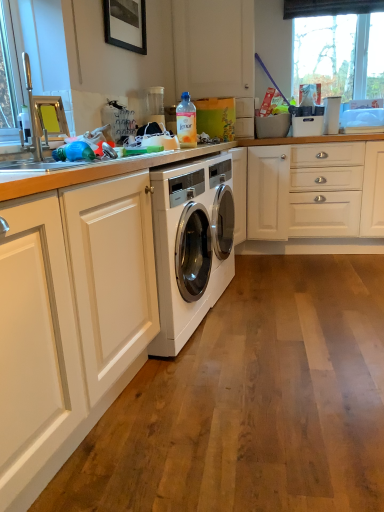
Measure the distance between transparent glass window at upper right and camera.

transparent glass window at upper right is 3.44 meters away from camera.

This screenshot has width=384, height=512. Identify the location of brushed metal sink at left. (40, 132).

The width and height of the screenshot is (384, 512). I want to click on black matte picture frame at upper center, so click(x=126, y=24).

From the image's perspective, is white glossy washing machine at center located beneath black matte picture frame at upper center?

Correct, white glossy washing machine at center appears lower than black matte picture frame at upper center in the image.

Which of these two, white glossy washing machine at center or black matte picture frame at upper center, is thinner?

With smaller width is black matte picture frame at upper center.

Does point (182, 227) come in front of point (128, 41)?

Yes, point (182, 227) is in front of point (128, 41).

Is white glossy washing machine at center oriented away from black matte picture frame at upper center?

No, black matte picture frame at upper center is not at the back of white glossy washing machine at center.

Considering the positions of points (326, 45) and (135, 49), is point (326, 45) closer to camera compared to point (135, 49)?

No.

Does transparent glass window at upper right turn towards black matte picture frame at upper center?

No, transparent glass window at upper right does not turn towards black matte picture frame at upper center.

Considering their positions, is transparent glass window at upper right located in front of or behind black matte picture frame at upper center?

Visually, transparent glass window at upper right is located behind black matte picture frame at upper center.

Considering the relative sizes of transparent glass window at upper right and black matte picture frame at upper center in the image provided, is transparent glass window at upper right bigger than black matte picture frame at upper center?

Yes.

Is brushed metal sink at left facing away from translucent plastic bottle at upper center?

No.

Is there a large distance between brushed metal sink at left and translucent plastic bottle at upper center?

brushed metal sink at left is actually quite close to translucent plastic bottle at upper center.

From the image's perspective, which is below, brushed metal sink at left or translucent plastic bottle at upper center?

brushed metal sink at left appears lower in the image.

Which object is thinner, white glossy washing machine at center or transparent glass window at upper right?

transparent glass window at upper right.

Looking at the image, does white glossy washing machine at center seem bigger or smaller compared to transparent glass window at upper right?

white glossy washing machine at center is bigger than transparent glass window at upper right.

How different are the orientations of white glossy washing machine at center and transparent glass window at upper right in degrees?

The angle between the facing direction of white glossy washing machine at center and the facing direction of transparent glass window at upper right is 80.7 degrees.

Looking at this image, is white glossy washing machine at center situated inside transparent glass window at upper right or outside?

white glossy washing machine at center is not inside transparent glass window at upper right, it's outside.

From the image's perspective, which is above, brushed metal sink at left or transparent glass window at upper right?

transparent glass window at upper right is shown above in the image.

Is brushed metal sink at left aimed at transparent glass window at upper right?

No, brushed metal sink at left does not turn towards transparent glass window at upper right.

In terms of width, does brushed metal sink at left look wider or thinner when compared to transparent glass window at upper right?

brushed metal sink at left is wider than transparent glass window at upper right.

Which is farther from the camera, (32, 106) or (376, 95)?

Point (376, 95)

Is brushed metal sink at left beside white glossy washing machine at center?

No, brushed metal sink at left is not with white glossy washing machine at center.

Who is taller, brushed metal sink at left or white glossy washing machine at center?

Standing taller between the two is white glossy washing machine at center.

Visually, is brushed metal sink at left positioned to the left or to the right of white glossy washing machine at center?

Based on their positions, brushed metal sink at left is located to the left of white glossy washing machine at center.

From the image's perspective, does brushed metal sink at left appear lower than white glossy washing machine at center?

Actually, brushed metal sink at left appears above white glossy washing machine at center in the image.

Is translucent plastic bottle at upper center not near black matte picture frame at upper center?

They are positioned close to each other.

Looking at this image, is translucent plastic bottle at upper center bigger or smaller than black matte picture frame at upper center?

Considering their sizes, translucent plastic bottle at upper center takes up less space than black matte picture frame at upper center.

From the image's perspective, which one is positioned lower, translucent plastic bottle at upper center or black matte picture frame at upper center?

translucent plastic bottle at upper center appears lower in the image.

This screenshot has height=512, width=384. Find the location of `picture frame on the left of the white glossy washing machine at center`. picture frame on the left of the white glossy washing machine at center is located at coordinates (126, 24).

Identify the location of picture frame located below the transparent glass window at upper right (from the image's perspective). (126, 24).

Estimate the real-world distances between objects in this image. Which object is closer to transparent glass window at upper right, white glossy washing machine at center or brushed metal sink at left?

white glossy washing machine at center is closer to transparent glass window at upper right.

From the image, which object appears to be farther from white glossy washing machine at center, brushed metal sink at left or transparent glass window at upper right?

Among the two, transparent glass window at upper right is located further to white glossy washing machine at center.

Consider the image. Considering their positions, is transparent glass window at upper right positioned further to black matte picture frame at upper center than white glossy washing machine at center?

transparent glass window at upper right is positioned further to the anchor black matte picture frame at upper center.

Estimate the real-world distances between objects in this image. Which object is closer to translucent plastic bottle at upper center, white glossy washing machine at center or brushed metal sink at left?

The object closer to translucent plastic bottle at upper center is white glossy washing machine at center.

Estimate the real-world distances between objects in this image. Which object is closer to white glossy washing machine at center, translucent plastic bottle at upper center or transparent glass window at upper right?

Among the two, translucent plastic bottle at upper center is located nearer to white glossy washing machine at center.

Looking at the image, which one is located closer to translucent plastic bottle at upper center, black matte picture frame at upper center or transparent glass window at upper right?

Based on the image, black matte picture frame at upper center appears to be nearer to translucent plastic bottle at upper center.

Estimate the real-world distances between objects in this image. Which object is further from black matte picture frame at upper center, white glossy washing machine at center or brushed metal sink at left?

white glossy washing machine at center lies further to black matte picture frame at upper center than the other object.

In the scene shown: Estimate the real-world distances between objects in this image. Which object is further from black matte picture frame at upper center, transparent glass window at upper right or translucent plastic bottle at upper center?

transparent glass window at upper right.

Image resolution: width=384 pixels, height=512 pixels. Identify the location of bottle positioned between brushed metal sink at left and black matte picture frame at upper center from near to far. pos(186,122).

What are the coordinates of `washing machine located between black matte picture frame at upper center and transparent glass window at upper right in the left-right direction` in the screenshot? It's located at (190, 246).

Where is `bottle between brushed metal sink at left and transparent glass window at upper right along the z-axis`? This screenshot has width=384, height=512. bottle between brushed metal sink at left and transparent glass window at upper right along the z-axis is located at coordinates tap(186, 122).

Where is `bottle that lies between black matte picture frame at upper center and white glossy washing machine at center from top to bottom`? This screenshot has width=384, height=512. bottle that lies between black matte picture frame at upper center and white glossy washing machine at center from top to bottom is located at coordinates (186, 122).